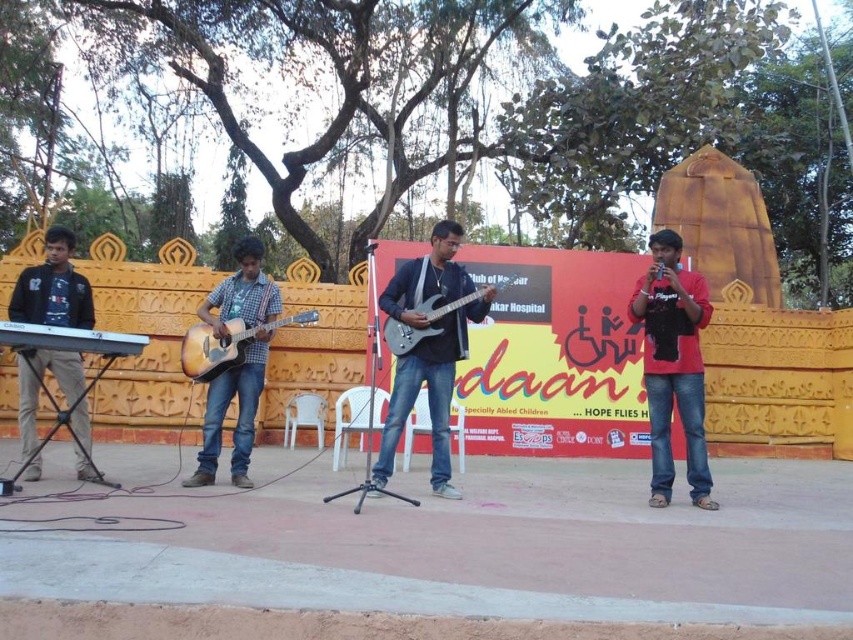
You are a photographer at the live music performance. You need to capture a photo that includes both the red matte shirt at right and the glossy electric guitar at center. Based on their positions, which object should you position on the left side of your camera frame?

The glossy electric guitar at center should be positioned on the left side of your camera frame because the red matte shirt at right is to the right of it.

You are a photographer at the live music performance and want to capture the wooden acoustic guitar at center in your shot. Based on its position, which coordinate point should you aim your camera at?

You should aim your camera at the coordinate point [239,364] to capture the wooden acoustic guitar at center.

You are a photographer setting up a shot of the live music performance. You need to ensure that the red matte shirt at right and the glossy electric guitar at center are both in focus. Given their sizes, which object should you prioritize focusing on first to ensure clarity?

The red matte shirt at right is thinner than the glossy electric guitar at center, so you should prioritize focusing on the glossy electric guitar at center first because it is larger and may require more precise focus to capture details.